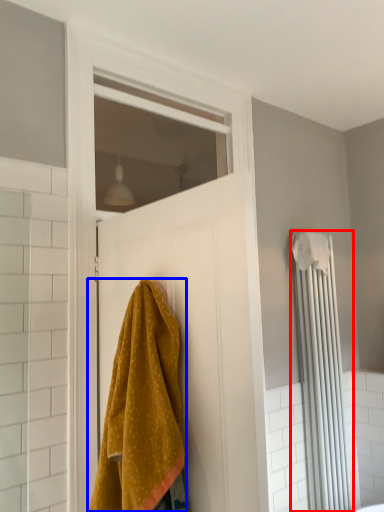
Question: Which object appears farthest to the camera in this image, shower curtain (highlighted by a red box) or towel (highlighted by a blue box)?

Choices:
 (A) shower curtain
 (B) towel

Answer: (A)